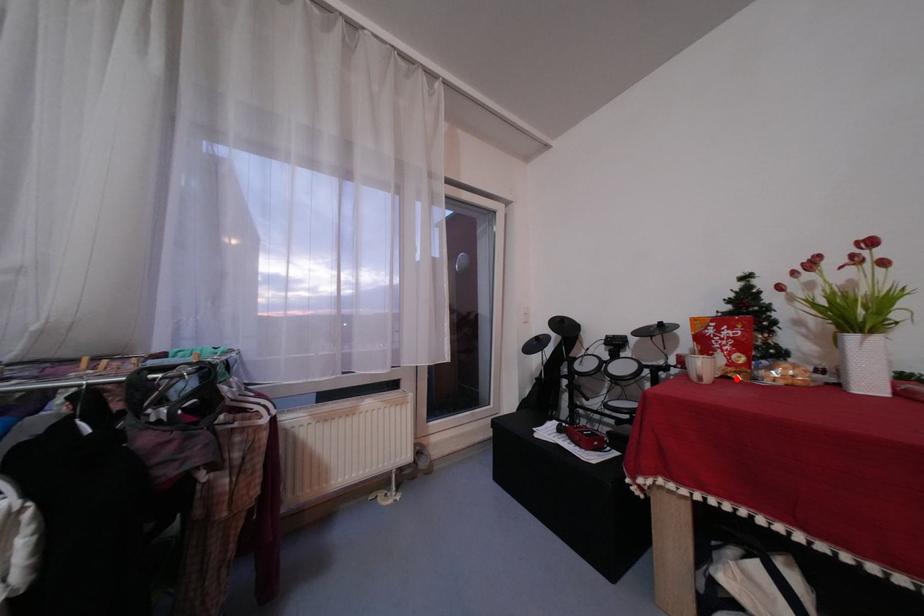
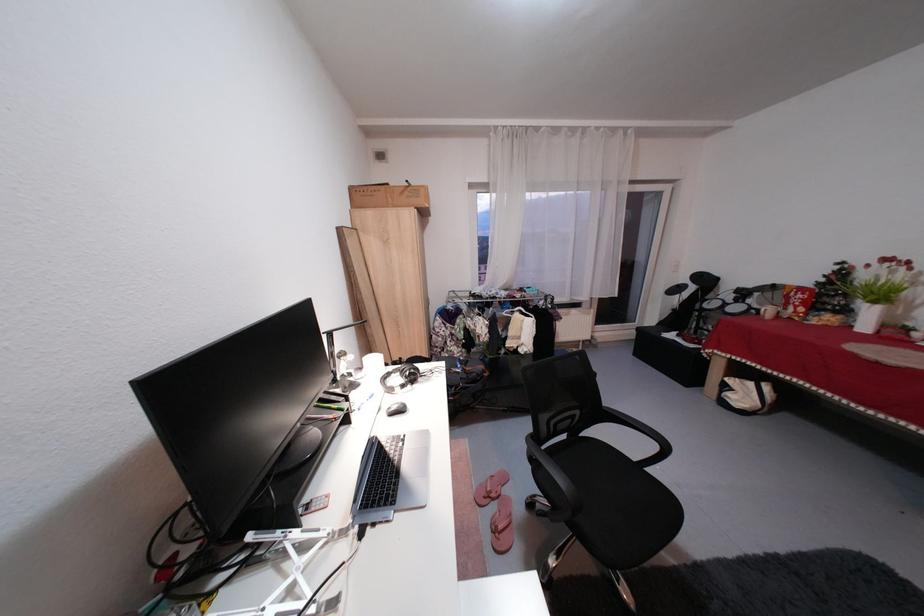
In the second image, find the point that corresponds to the highlighted location in the first image.

(800, 320)